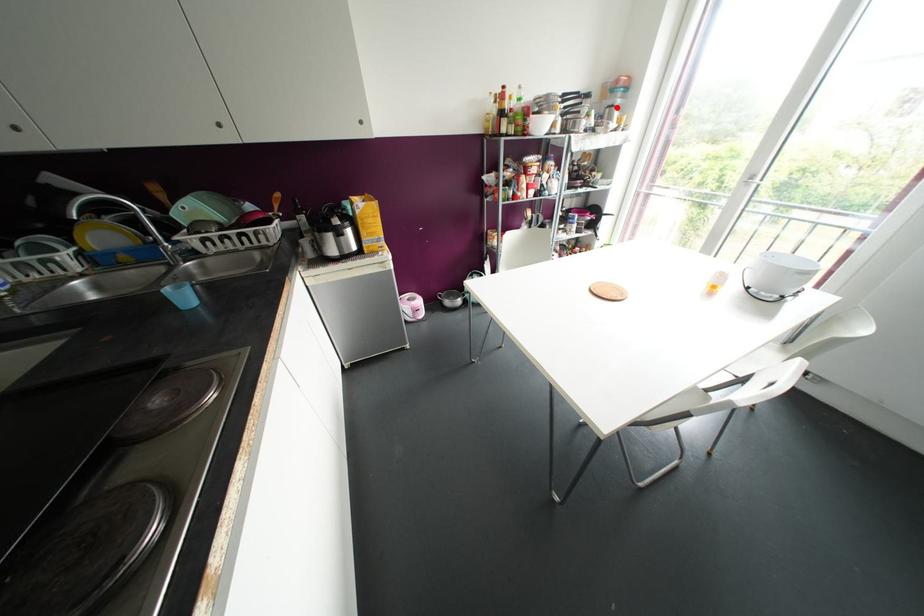
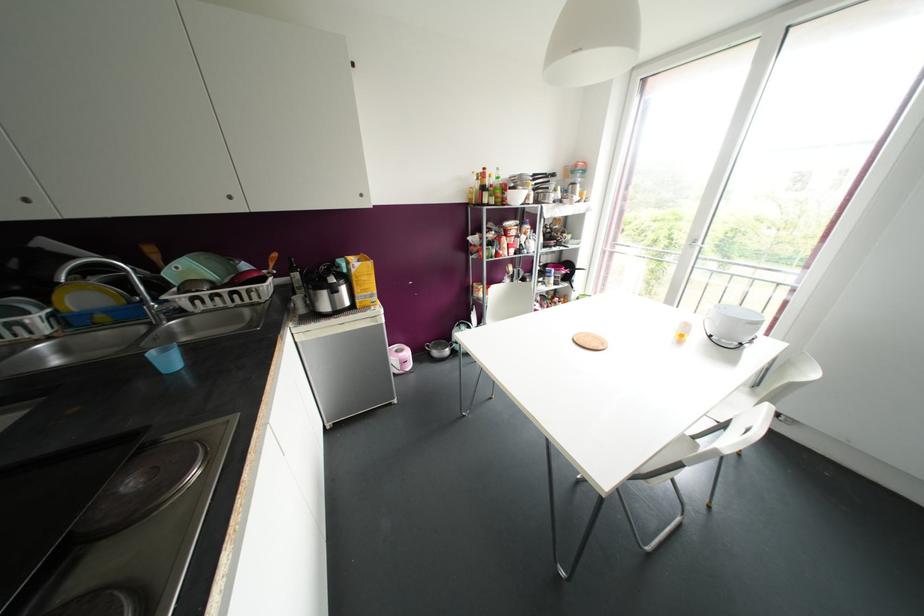
In the second image, find the point that corresponds to the highlighted location in the first image.

(578, 185)